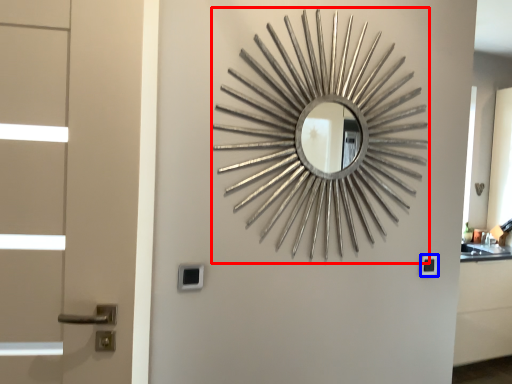
Question: Which object is further to the camera taking this photo, design (highlighted by a red box) or lock (highlighted by a blue box)?

Choices:
 (A) design
 (B) lock

Answer: (B)